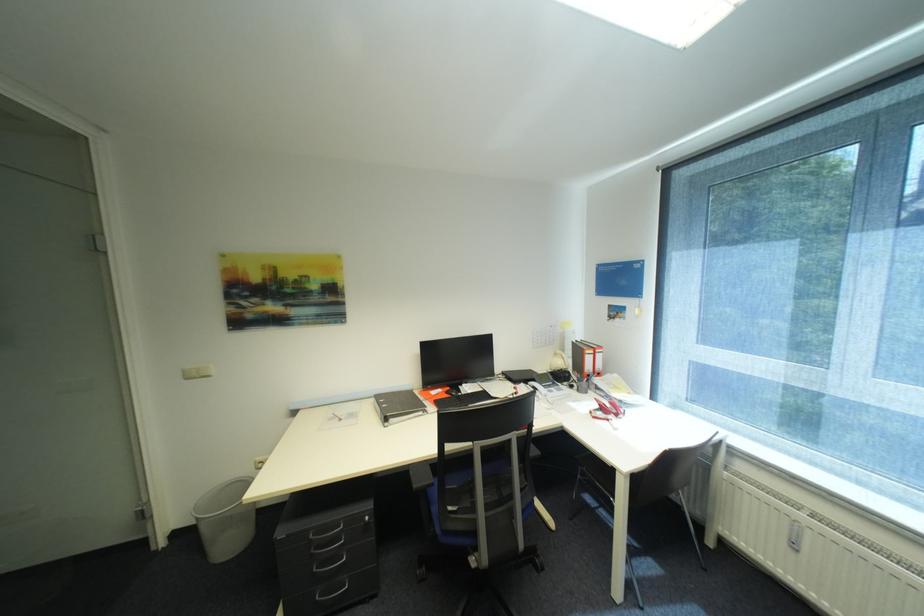
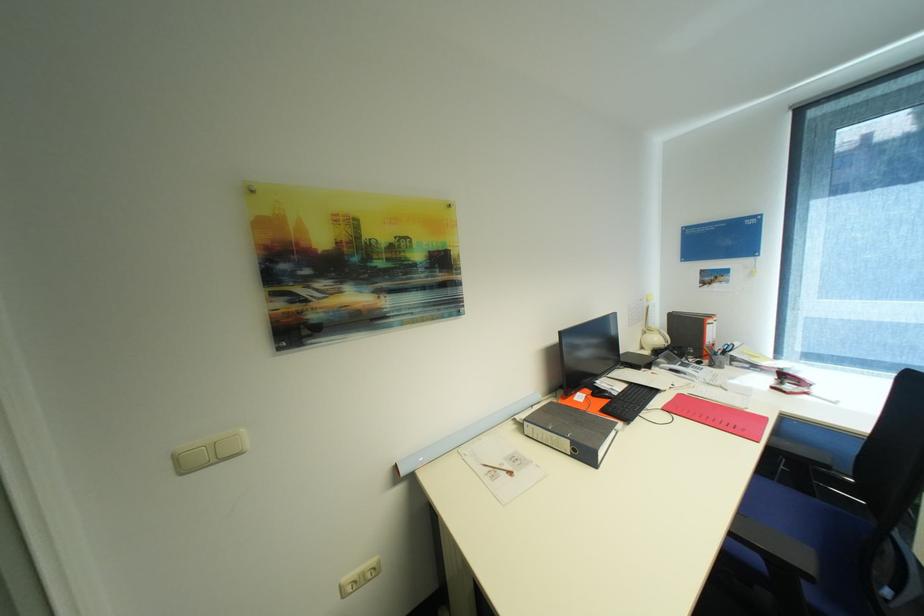
Where in the second image is the point corresponding to (x=567, y=363) from the first image?

(663, 339)